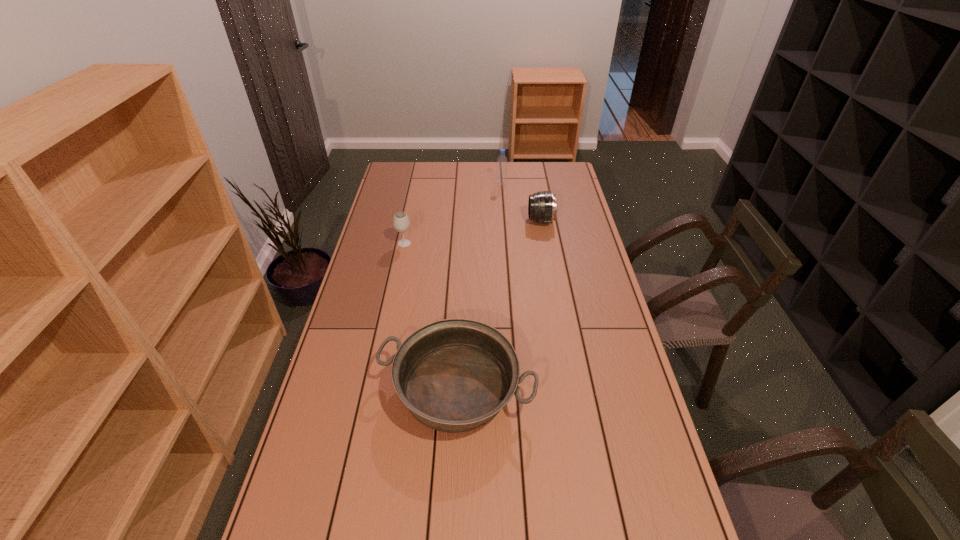
You are a GUI agent. You are given a task and a screenshot of the screen. Output one action in this format:
    pyautogui.click(x=<x>, y=<y>)
    Task: Click on the free spot between the second nearest object and the telephoto lens
    This screenshot has width=960, height=540.
    Given the screenshot: What is the action you would take?
    pyautogui.click(x=472, y=232)

This screenshot has height=540, width=960. Identify the location of free point between the telephoto lens and the shortest object. (498, 305).

This screenshot has height=540, width=960. What are the coordinates of `vacant space that's between the second nearest object and the rightmost object` in the screenshot? It's located at (472, 232).

At what (x,y) coordinates should I click in order to perform the action: click on empty space that is in between the shortest object and the wineglass. Please return your answer as a coordinate pair (x, y). Looking at the image, I should click on (430, 316).

At what (x,y) coordinates should I click in order to perform the action: click on unoccupied position between the bottle and the pan. Please return your answer as a coordinate pair (x, y). This screenshot has height=540, width=960. Looking at the image, I should click on (479, 287).

I want to click on free spot between the shortest object and the second farthest object, so click(498, 305).

You are a GUI agent. You are given a task and a screenshot of the screen. Output one action in this format:
    pyautogui.click(x=<x>, y=<y>)
    Task: Click on the free space between the shortest object and the telephoto lens
    The width and height of the screenshot is (960, 540).
    Given the screenshot: What is the action you would take?
    pyautogui.click(x=498, y=305)

Find the location of a particular element. The height and width of the screenshot is (540, 960). vacant area between the tallest object and the shortest object is located at coordinates (479, 287).

Find the location of `object that is the closest to the wineglass`. object that is the closest to the wineglass is located at coordinates (454, 375).

Select which object appears as the third closest to the rightmost object. Please provide its 2D coordinates. Your answer should be formatted as a tuple, i.e. [(x, y)], where the tuple contains the x and y coordinates of a point satisfying the conditions above.

[(454, 375)]